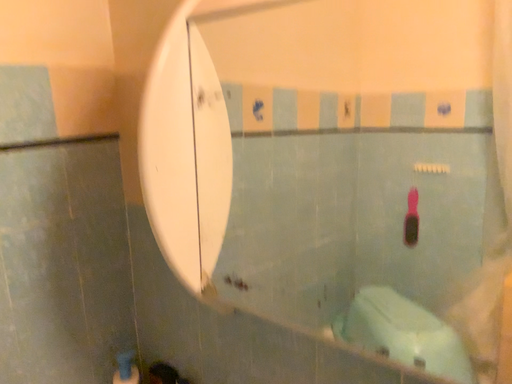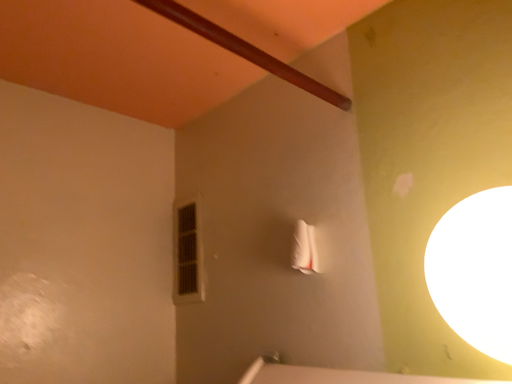
Question: Which way did the camera rotate in the video?

Choices:
 (A) rotated downward
 (B) rotated upward

Answer: (B)